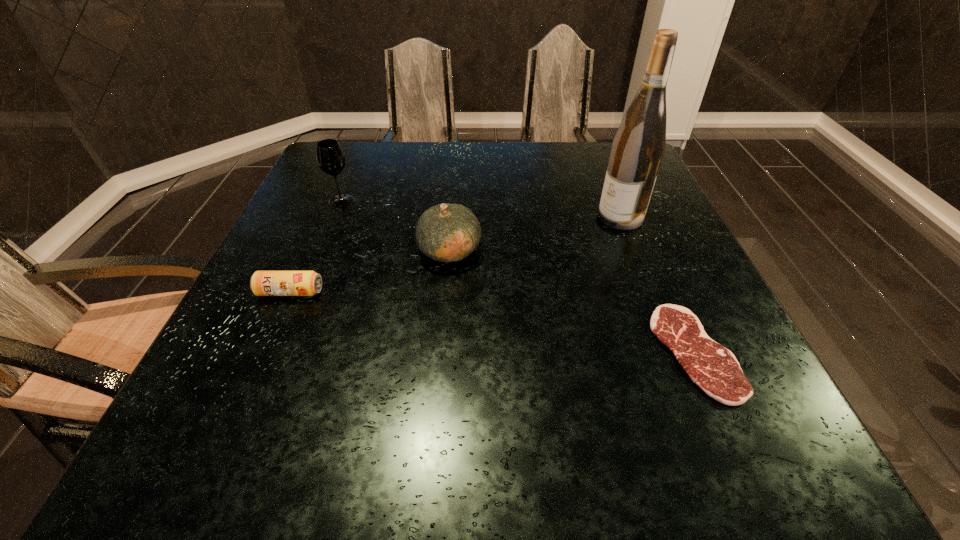
Where is `free space located on the front of the gourd`? free space located on the front of the gourd is located at coordinates (436, 414).

I want to click on vacant space located on the right of the second shortest object, so click(392, 292).

At what (x,y) coordinates should I click in order to perform the action: click on free space located 0.210m on the left of the steak. Please return your answer as a coordinate pair (x, y). The width and height of the screenshot is (960, 540). Looking at the image, I should click on (539, 352).

At what (x,y) coordinates should I click in order to perform the action: click on wineglass located in the left edge section of the desktop. Please return your answer as a coordinate pair (x, y). This screenshot has width=960, height=540. Looking at the image, I should click on (330, 158).

Locate an element on the screen. Image resolution: width=960 pixels, height=540 pixels. beer can that is at the left edge is located at coordinates (262, 283).

The height and width of the screenshot is (540, 960). I want to click on wine bottle that is positioned at the right edge, so click(637, 150).

Find the location of a particular element. This screenshot has height=540, width=960. steak present at the right edge is located at coordinates [x=715, y=369].

Locate an element on the screen. This screenshot has width=960, height=540. vacant space at the far edge of the desktop is located at coordinates (378, 164).

Identify the location of vacant space at the near edge of the desktop. (450, 474).

Find the location of `free space at the left edge of the desktop`. free space at the left edge of the desktop is located at coordinates (302, 203).